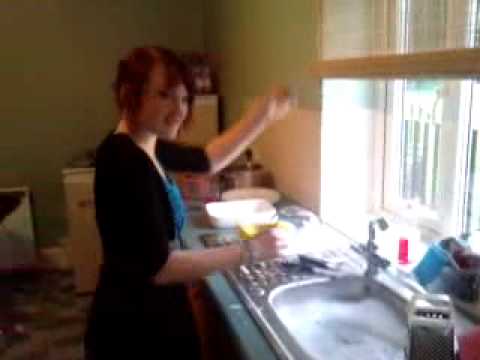
Find the location of a particular element. chest is located at coordinates (174, 183).